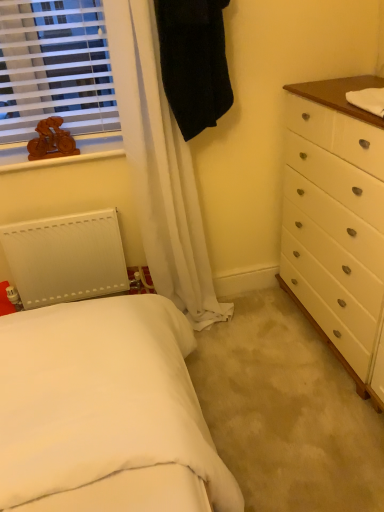
Question: Considering the relative sizes of wooden bicycle at upper left and wooden bicycle at upper left in the image provided, is wooden bicycle at upper left wider than wooden bicycle at upper left?

Choices:
 (A) yes
 (B) no

Answer: (B)

Question: Is wooden bicycle at upper left taller than wooden bicycle at upper left?

Choices:
 (A) yes
 (B) no

Answer: (A)

Question: Is wooden bicycle at upper left smaller than wooden bicycle at upper left?

Choices:
 (A) no
 (B) yes

Answer: (A)

Question: Is wooden bicycle at upper left oriented away from wooden bicycle at upper left?

Choices:
 (A) yes
 (B) no

Answer: (B)

Question: Considering the relative positions of wooden bicycle at upper left and wooden bicycle at upper left in the image provided, is wooden bicycle at upper left in front of wooden bicycle at upper left?

Choices:
 (A) no
 (B) yes

Answer: (B)

Question: Can you confirm if wooden bicycle at upper left is positioned to the left of wooden bicycle at upper left?

Choices:
 (A) yes
 (B) no

Answer: (B)

Question: Can you confirm if black fabric robe at upper center is positioned to the right of wooden bicycle at upper left?

Choices:
 (A) no
 (B) yes

Answer: (B)

Question: From the image's perspective, does black fabric robe at upper center appear higher than wooden bicycle at upper left?

Choices:
 (A) yes
 (B) no

Answer: (A)

Question: Can you confirm if black fabric robe at upper center is taller than wooden bicycle at upper left?

Choices:
 (A) no
 (B) yes

Answer: (B)

Question: Can we say black fabric robe at upper center lies outside wooden bicycle at upper left?

Choices:
 (A) no
 (B) yes

Answer: (B)

Question: Does black fabric robe at upper center have a smaller size compared to wooden bicycle at upper left?

Choices:
 (A) no
 (B) yes

Answer: (A)

Question: Would you say black fabric robe at upper center contains wooden bicycle at upper left?

Choices:
 (A) yes
 (B) no

Answer: (B)

Question: Considering the relative sizes of brown wooden counter top at upper right and wooden bicycle at upper left in the image provided, is brown wooden counter top at upper right thinner than wooden bicycle at upper left?

Choices:
 (A) no
 (B) yes

Answer: (A)